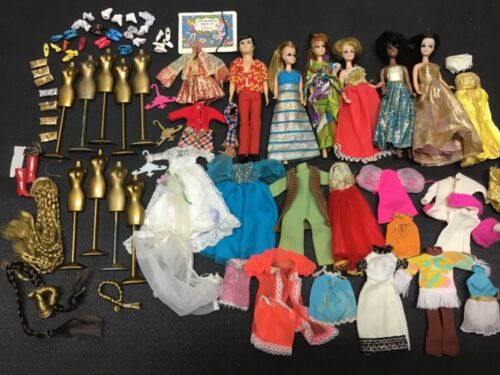
Where is `female dolls`? The image size is (500, 375). female dolls is located at coordinates 288,54, 314,53, 353,54, 393,51, 428,50.